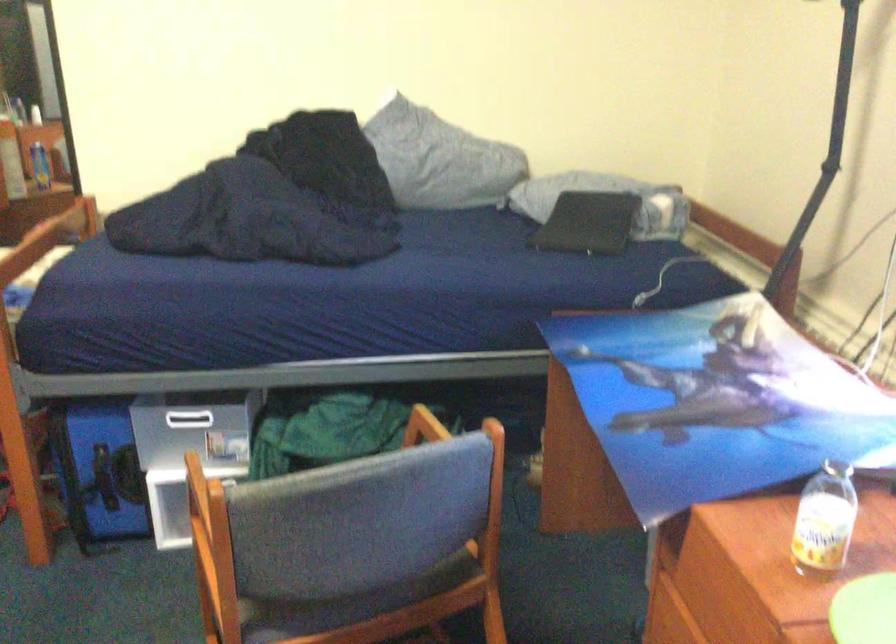
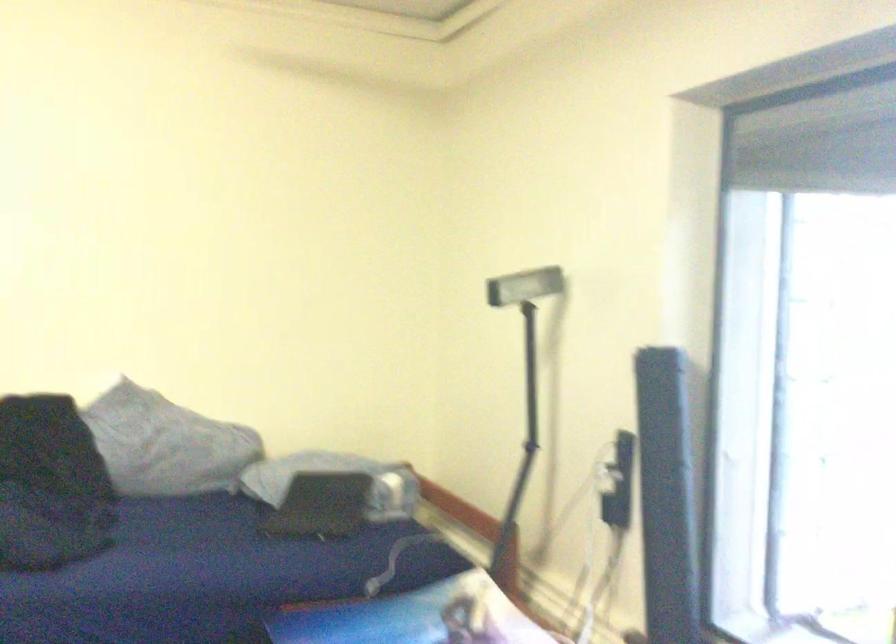
Find the pixel in the second image that matches pixel 440 158 in the first image.

(166, 444)